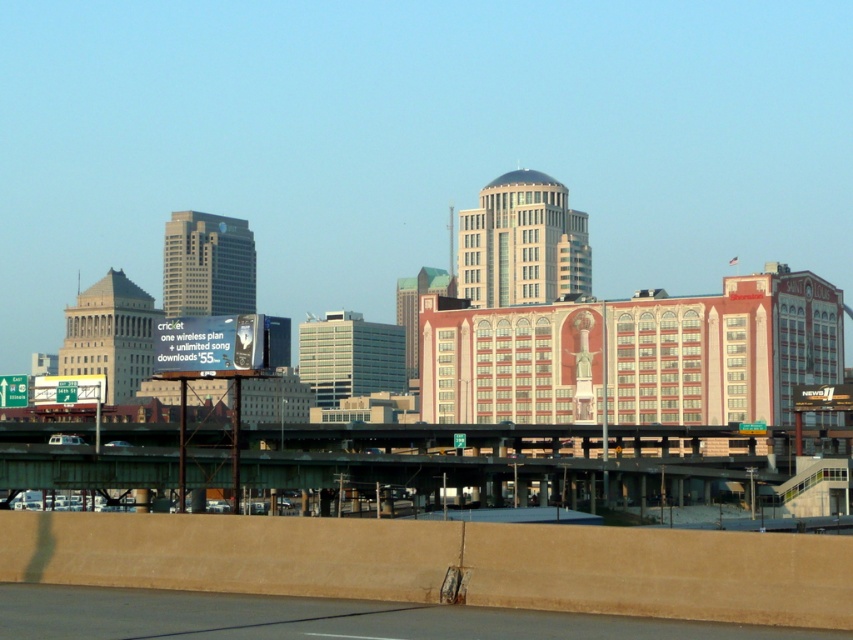
Does green metallic bridge at center have a greater width compared to concrete pavement at lower center?

Yes, green metallic bridge at center is wider than concrete pavement at lower center.

Looking at this image, measure the distance from green metallic bridge at center to concrete pavement at lower center.

169.42 meters

Who is more distant from viewer, (527, 429) or (260, 627)?

The point (527, 429) is more distant.

Locate an element on the screen. This screenshot has width=853, height=640. green metallic bridge at center is located at coordinates (521, 460).